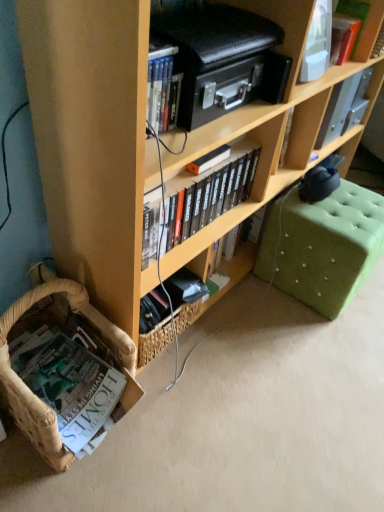
The width and height of the screenshot is (384, 512). In order to click on vacant space in front of white paper book at lower left, which is the 1th book in bottom-to-top order in this screenshot , I will do point(63,484).